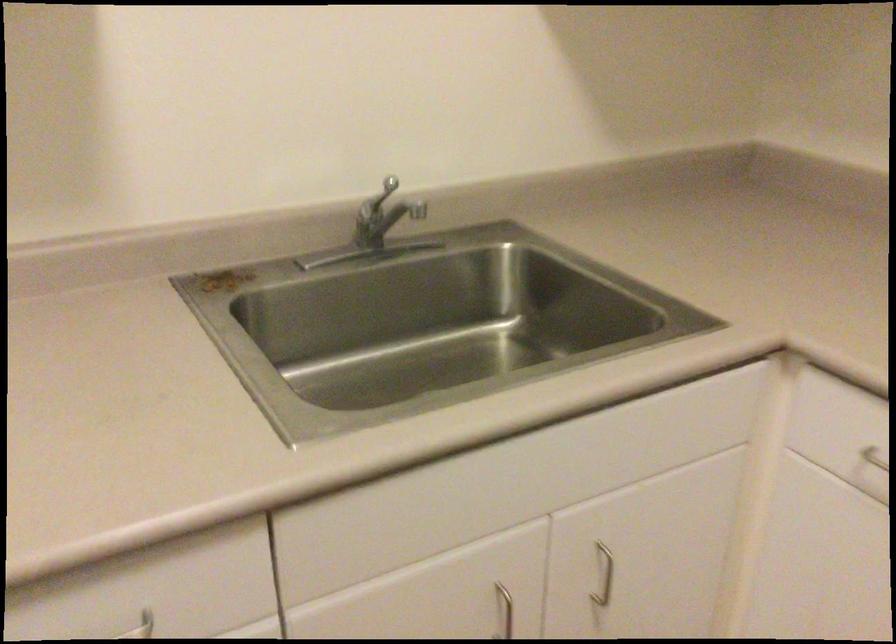
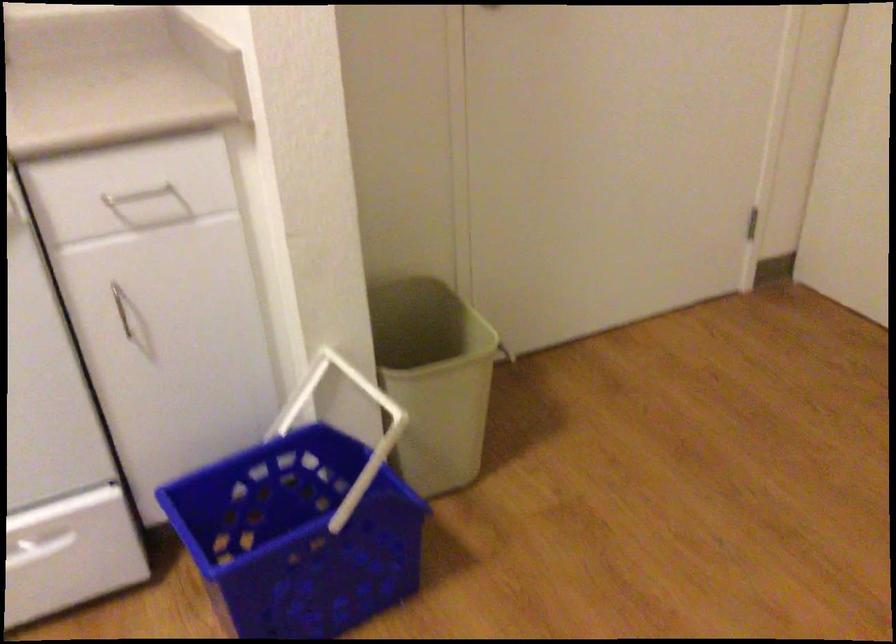
How did the camera likely rotate?

The camera's rotation is toward right-down.